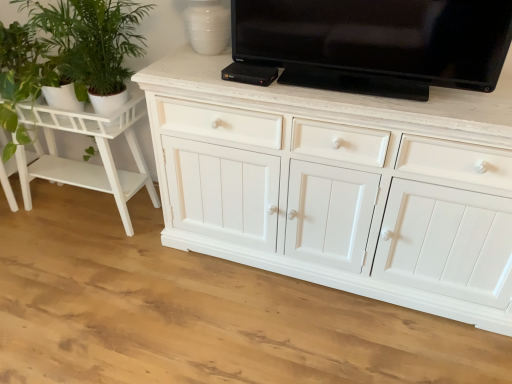
At what (x,y) coordinates should I click in order to perform the action: click on free region under green leafy plant at left (from a real-world perspective). Please return your answer as a coordinate pair (x, y). Looking at the image, I should click on (118, 241).